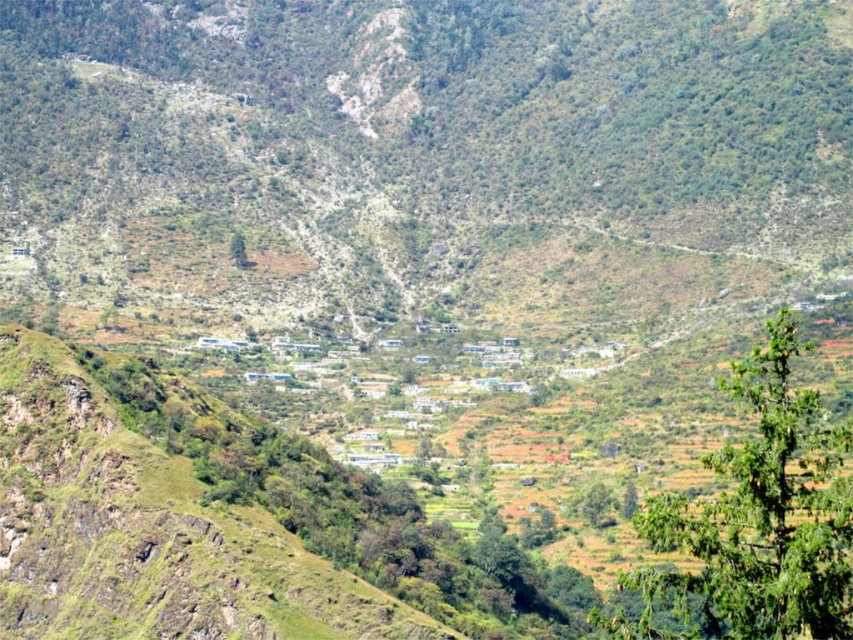
You are standing at the origin point in the image, which is the bottom left corner. You want to walk to the green leafy tree at right. In which general direction should you head?

The green leafy tree at right is located at coordinates approximately 0.814 on the x and 0.889 on the y axis. Since the origin is the bottom left corner, moving towards higher x values goes to the right and higher y values go upwards. Therefore, to reach the green leafy tree at right, you should head northeast, combining right and upward movement.

You are a hiker planning to cross the valley between the green leafy tree at right and the green leafy tree at center. Which tree has a wider trunk that might provide better shade?

The green leafy tree at right has a wider trunk than the green leafy tree at center, so it might provide better shade.

You are a hiker standing at the edge of the valley looking towards the cluster of buildings. You notice two green leafy trees in the scene. Which tree, the green leafy tree at right or the green leafy tree at center, is closer to you?

The green leafy tree at right is closer to the viewer than the green leafy tree at center, so the green leafy tree at right is closer to you.